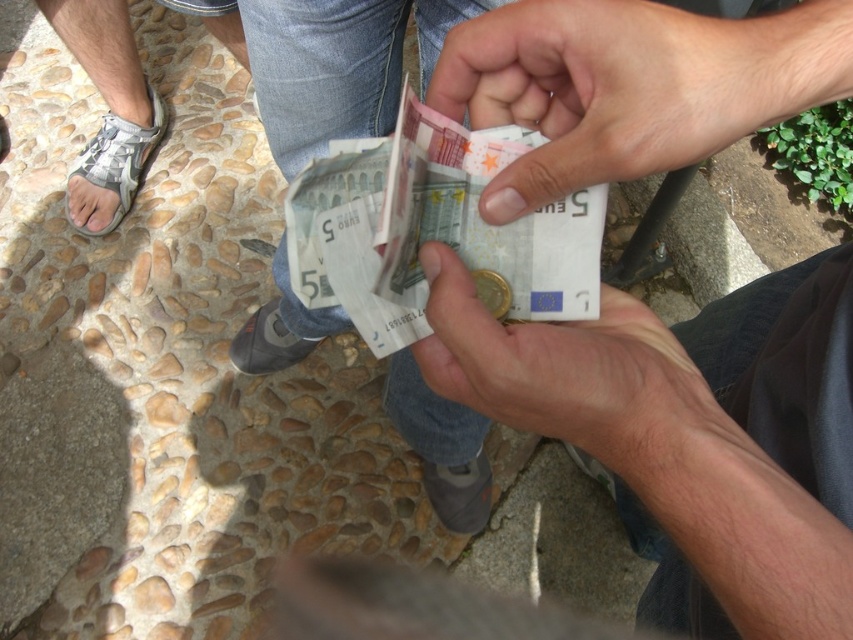
You are standing at the position of the person with the gray T shirt and dark pants. You see two points marked in the scene, point 1 at coordinates point (527, 26) and point 2 at coordinates point (375, 248). Which point is closer to you?

Point (527, 26) is in front of point (375, 248), so point (527, 26) is closer to you.

You are a cashier at a small store and you need to quickly identify the larger banknote to give change. You see the white paper banknotes at center and the matte paper money at center. Which one should you choose?

The white paper banknotes at center is bigger than matte paper money at center, so you should choose the white paper banknotes at center as it is larger.

You are standing in a park and see two people exchanging money. There is a specific point at coordinates point (416, 307) that is 18.63 inches away from you. If you want to take a photo of this point without moving closer, what is the minimum focal length required to capture it clearly?

The minimum focal length needed to capture the point at point (416, 307) clearly from 18.63 inches away depends on the camera sensor size and field of view. However, since the exact specifications aren